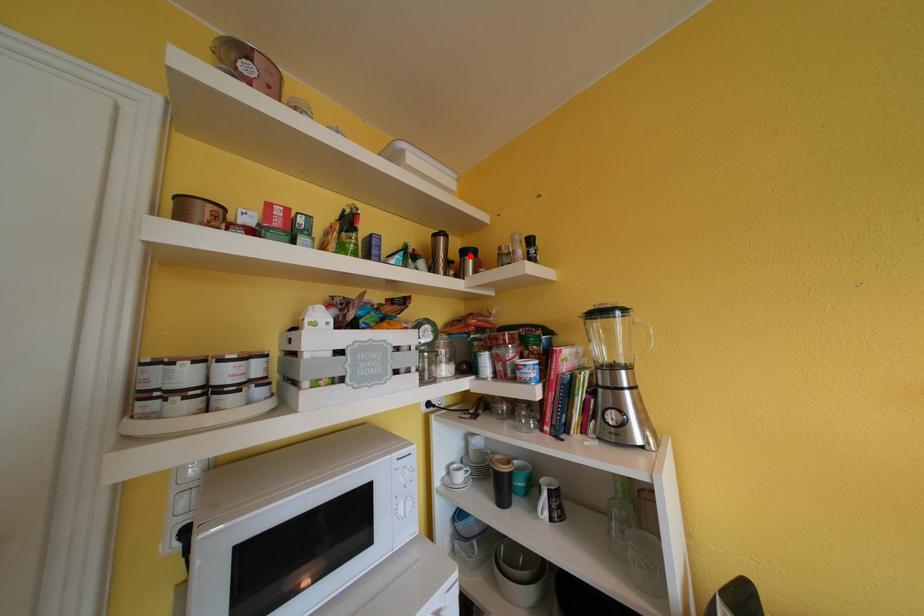
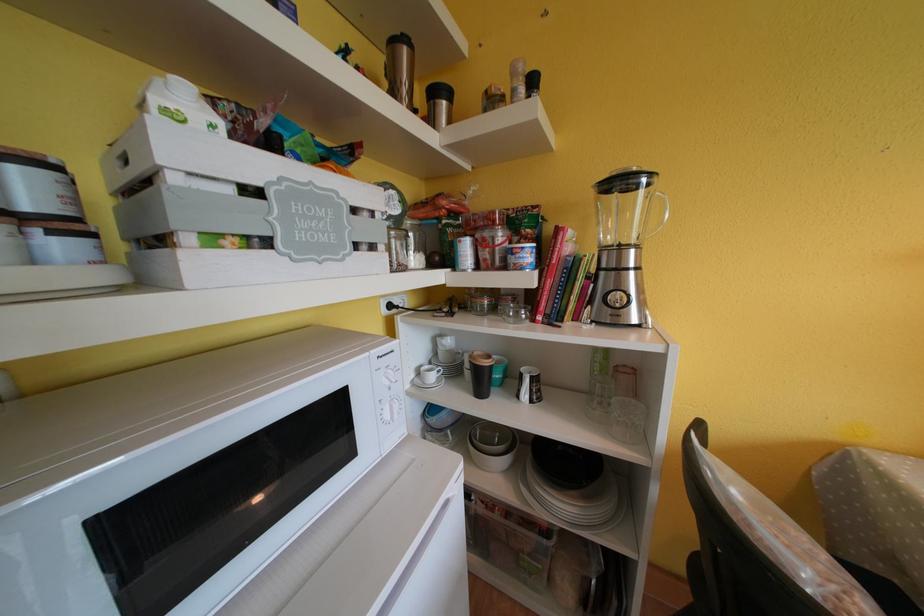
In the second image, find the point that corresponds to the highlighted location in the first image.

(440, 95)